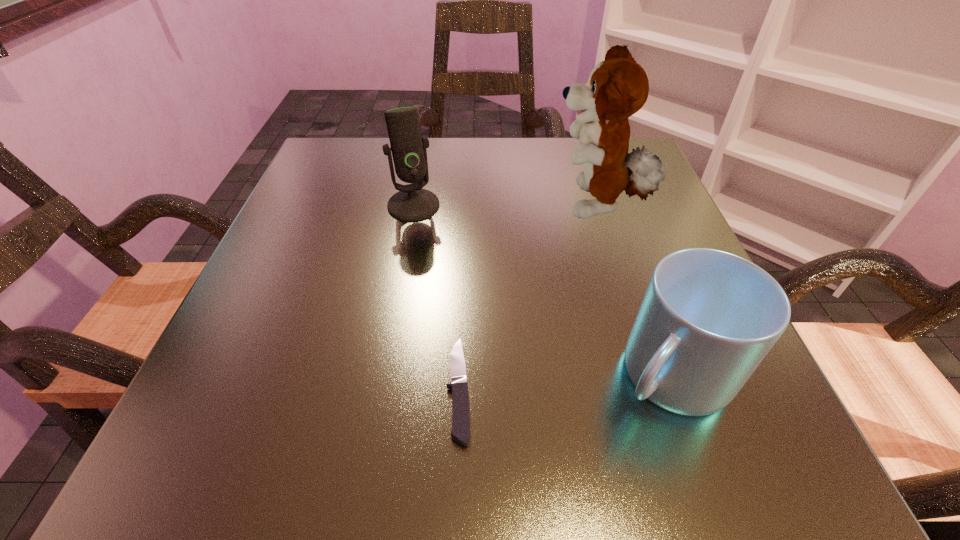
The image size is (960, 540). I want to click on puppy, so click(618, 87).

In order to click on the leftmost object in this screenshot , I will do `click(412, 203)`.

The image size is (960, 540). Find the location of `microphone`. microphone is located at coordinates (412, 203).

Identify the location of the second shortest object. pos(708,318).

Identify the location of the third object from right to left. (460, 402).

I want to click on steak knife, so click(460, 402).

Find the location of a particular element. This screenshot has height=540, width=960. vacant space situated on the face of the tallest object is located at coordinates (436, 207).

Where is `vacant region located on the face of the tallest object`? The width and height of the screenshot is (960, 540). vacant region located on the face of the tallest object is located at coordinates (471, 207).

Locate an element on the screen. vacant area situated 0.150m on the face of the tallest object is located at coordinates (471, 207).

The image size is (960, 540). Identify the location of free region located on the front of the leftmost object. (399, 282).